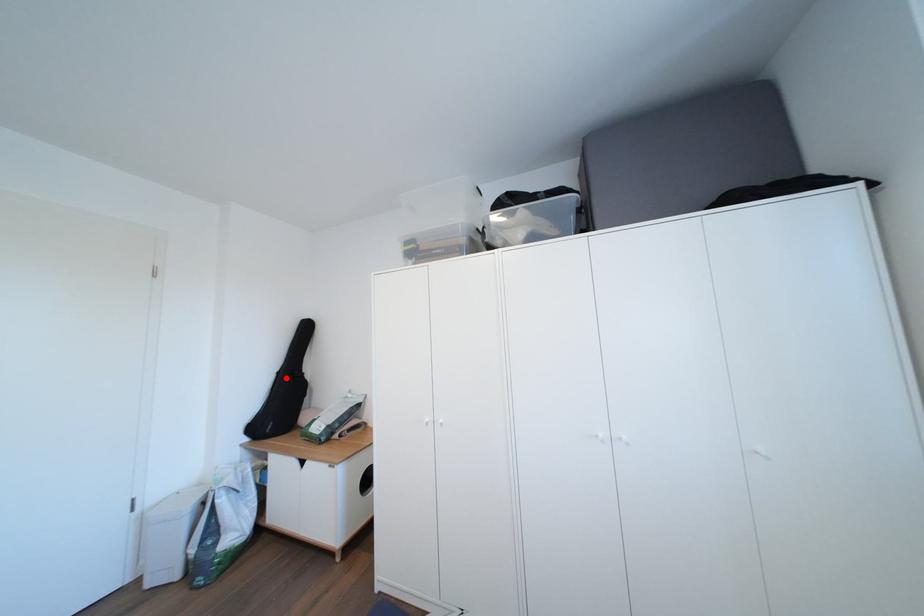
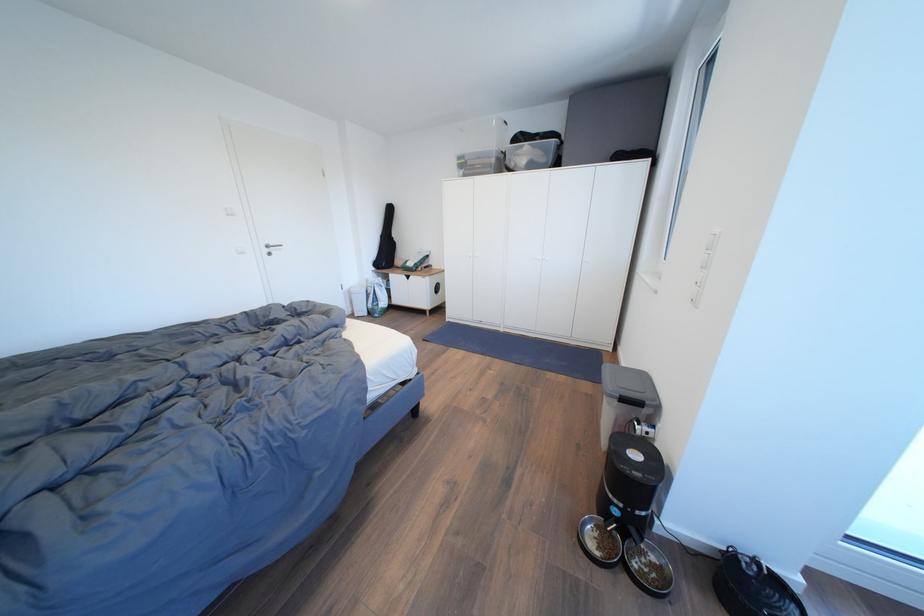
Question: A red point is marked in image1. In image2, is the corresponding 3D point closer to the camera or farther? Reply with the corresponding letter.

Choices:
 (A) The corresponding 3D point is closer.
 (B) The corresponding 3D point is farther.

Answer: (A)